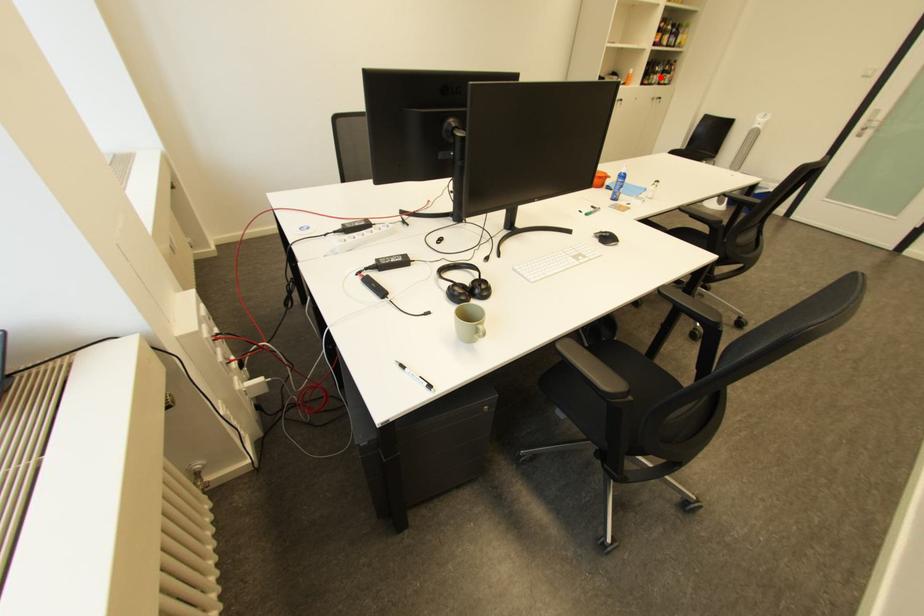
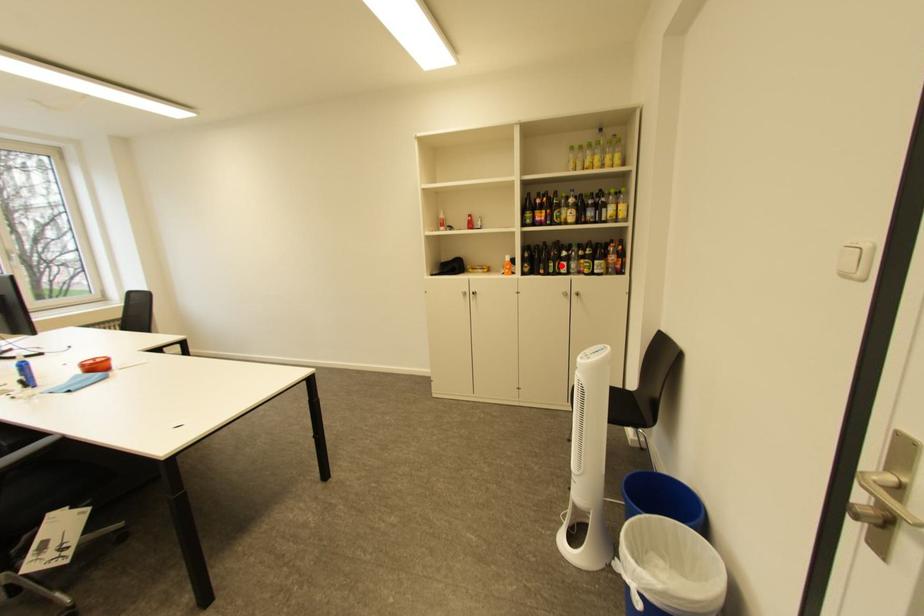
I am providing you with two images of the same scene from different viewpoints. A red point is marked on the first image and another point is marked on the second image. Does the point marked in image1 correspond to the same location as the one in image2?

Yes